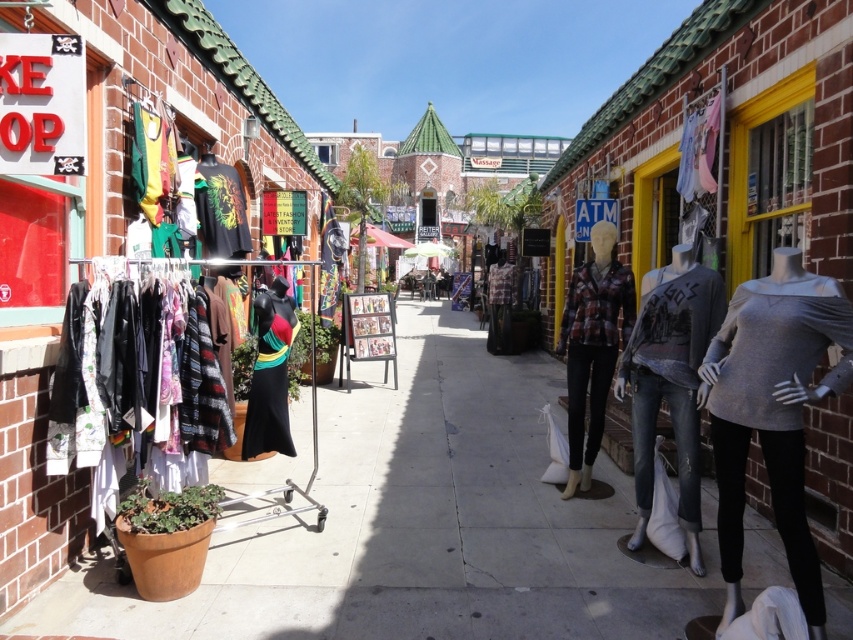
You are standing on the sidewalk in front of the shops. There are two points marked in the scene. The first point is at coordinates point (614, 240) and the second is at point (257, 403). Which point is closer to you?

Point (614, 240) is further to the viewer than point (257, 403), so the second point is closer to you.

Consider the image. You are a delivery person trying to place a package on the smooth concrete pavement at center. However, there is a clear glass window at right in the way. Can you move the package to the pavement without touching the window?

The smooth concrete pavement at center is in front of the clear glass window at right, so you can move the package to the pavement without touching the window because the pavement is positioned in front of the window.